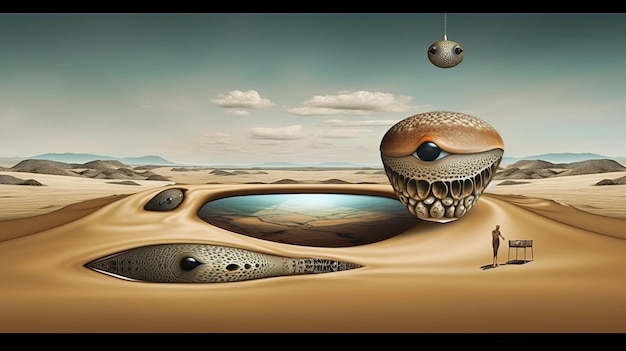
At what (x,y) coordinates should I click in order to perform the action: click on shadow below table. Please return your answer as a coordinate pair (x, y). Looking at the image, I should click on coord(519,263).